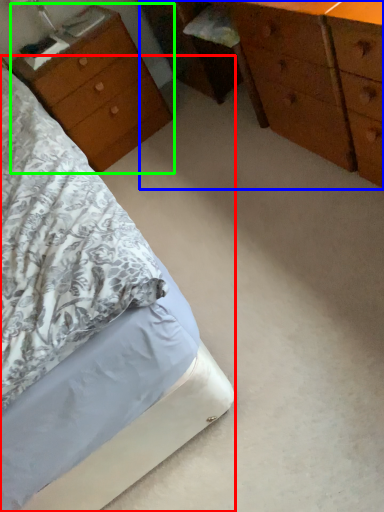
Question: Estimate the real-world distances between objects in this image. Which object is farther from bed (highlighted by a red box), chest of drawers (highlighted by a blue box) or nightstand (highlighted by a green box)?

Choices:
 (A) chest of drawers
 (B) nightstand

Answer: (A)